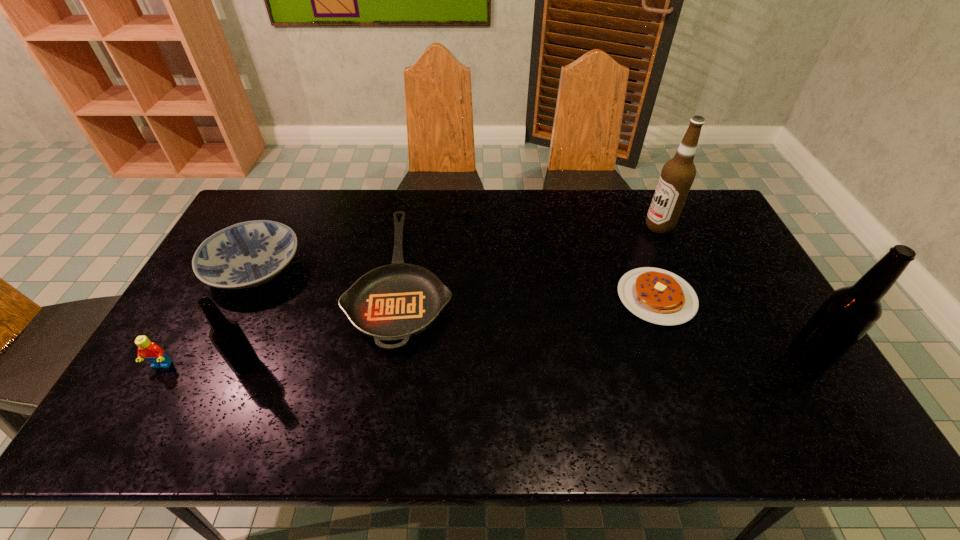
At what (x,y) coordinates should I click in order to perform the action: click on vacant position for inserting another beer_bottle evenly. Please return your answer as a coordinate pair (x, y). This screenshot has width=960, height=540. Looking at the image, I should click on 529,362.